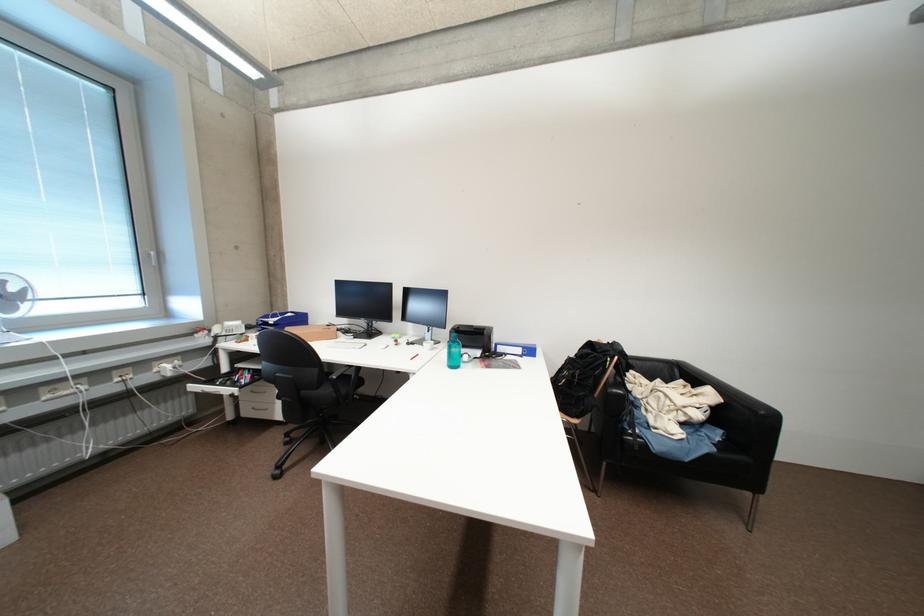
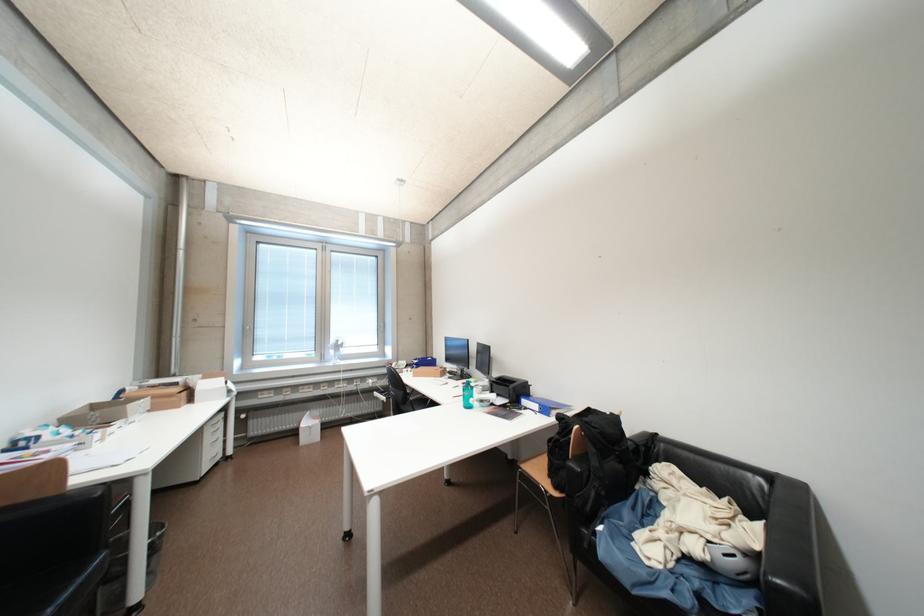
Locate, in the second image, the point that corresponds to (201,390) in the first image.

(383, 395)